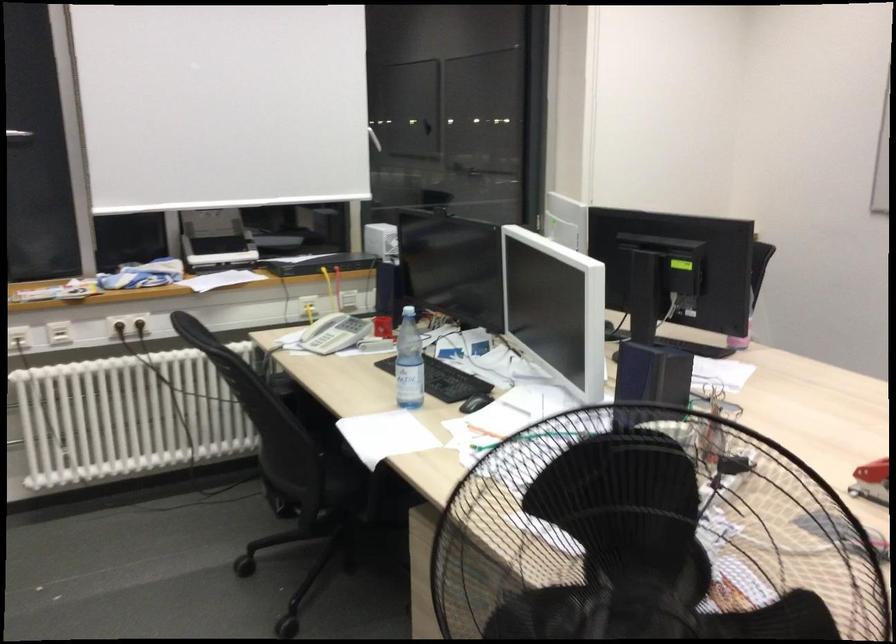
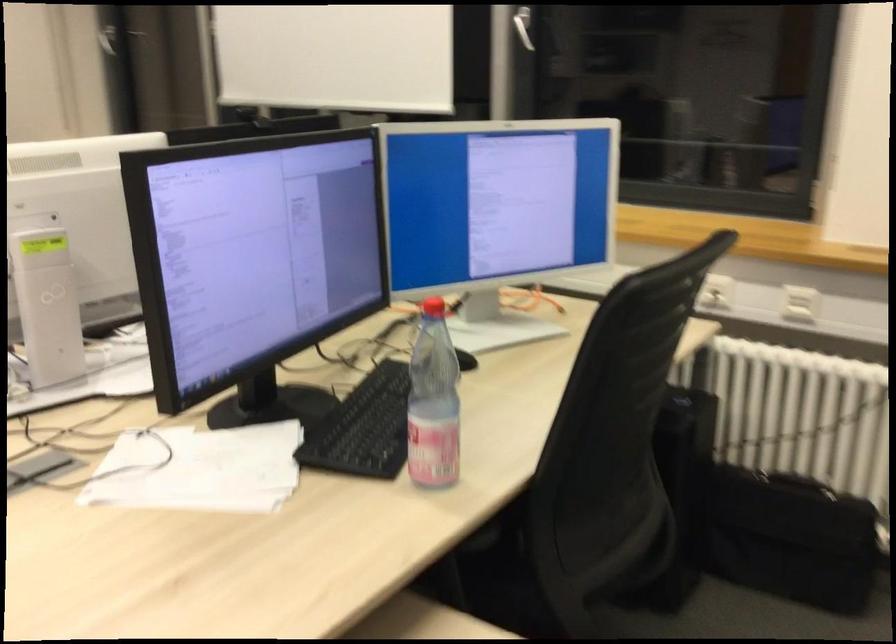
Where in the second image is the point corresponding to point (719, 384) from the first image?

(199, 469)